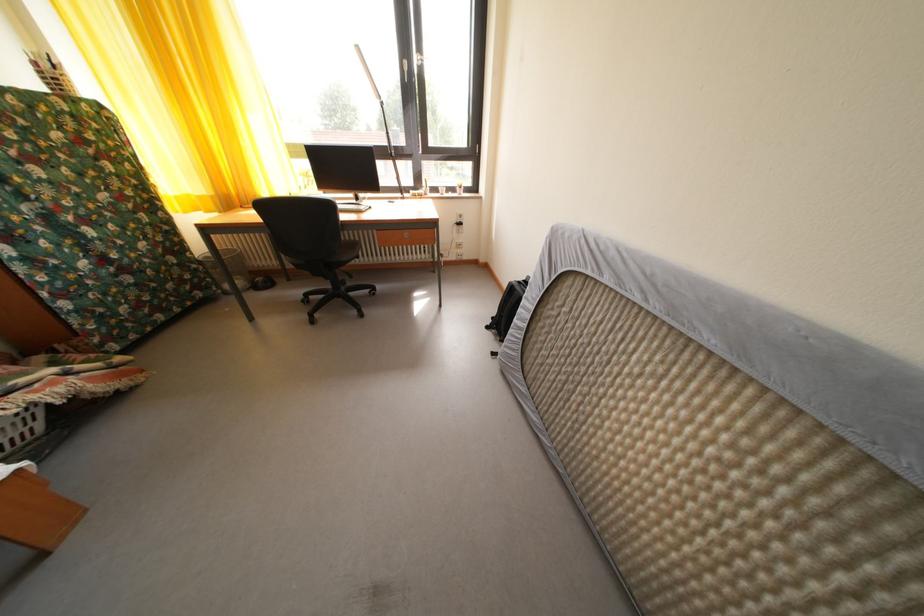
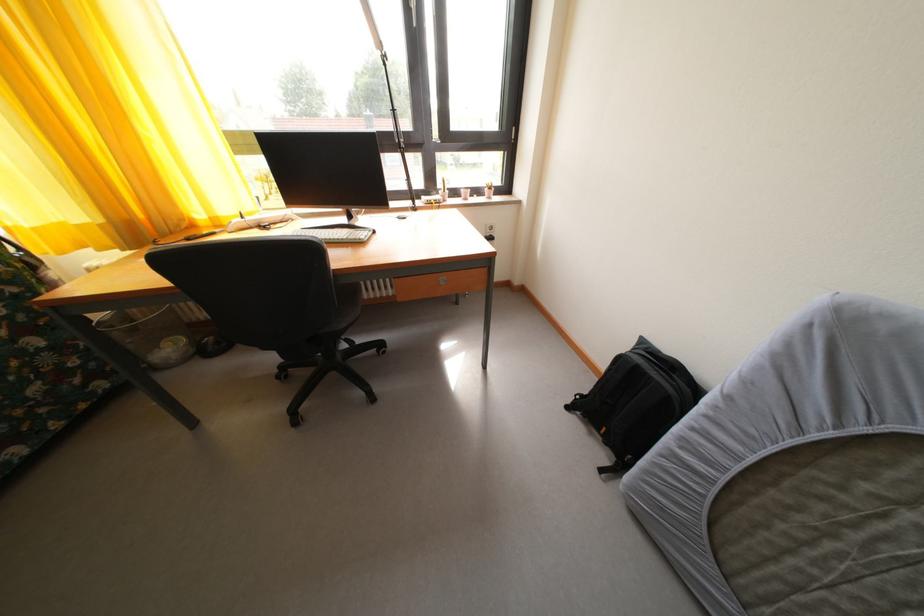
Question: The images are taken continuously from a first-person perspective. In which direction is your viewpoint rotating?

Choices:
 (A) Left
 (B) Right
 (C) Up
 (D) Down

Answer: (B)